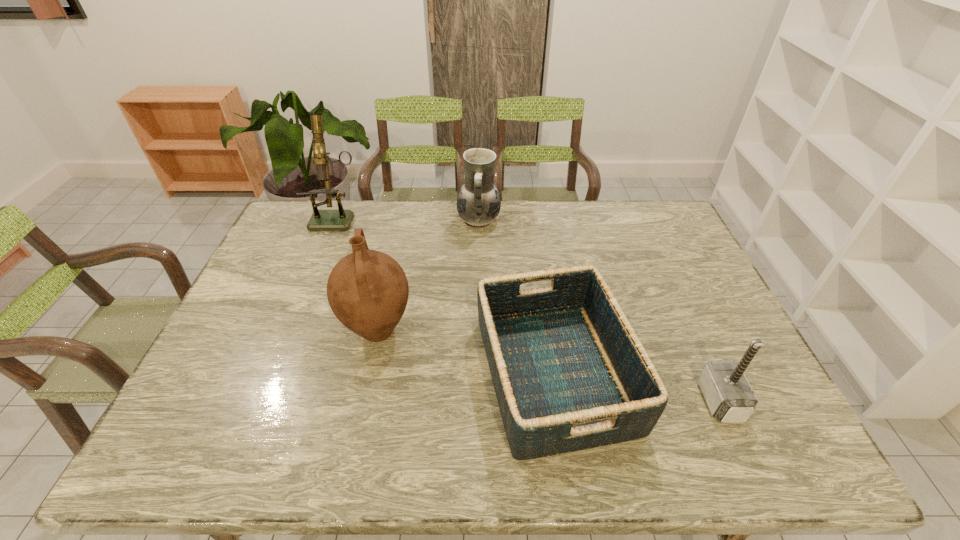
Where is `the leftmost object`? The width and height of the screenshot is (960, 540). the leftmost object is located at coordinates (341, 219).

Locate an element on the screen. This screenshot has width=960, height=540. the nearer pitcher is located at coordinates (367, 290).

The width and height of the screenshot is (960, 540). Find the location of `the left pitcher`. the left pitcher is located at coordinates (367, 290).

Identify the location of the right pitcher. The height and width of the screenshot is (540, 960). (478, 203).

Identify the location of the farther pitcher. (478, 203).

Where is `the fourth tallest object`? The image size is (960, 540). the fourth tallest object is located at coordinates (729, 396).

This screenshot has height=540, width=960. Identify the location of the rightmost object. (729, 396).

This screenshot has height=540, width=960. I want to click on basket, so click(x=569, y=372).

The width and height of the screenshot is (960, 540). I want to click on free space located 0.160m at the eyepiece of the leftmost object, so click(321, 261).

Identify the location of vacant space situated on the left of the taller pitcher. (255, 331).